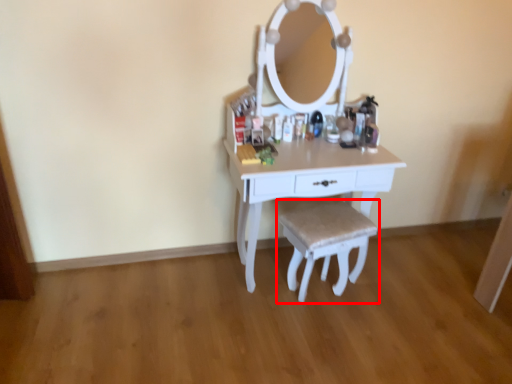
Question: From the image's perspective, what is the correct spatial positioning of step stool (annotated by the red box) in reference to table?

Choices:
 (A) below
 (B) above

Answer: (A)